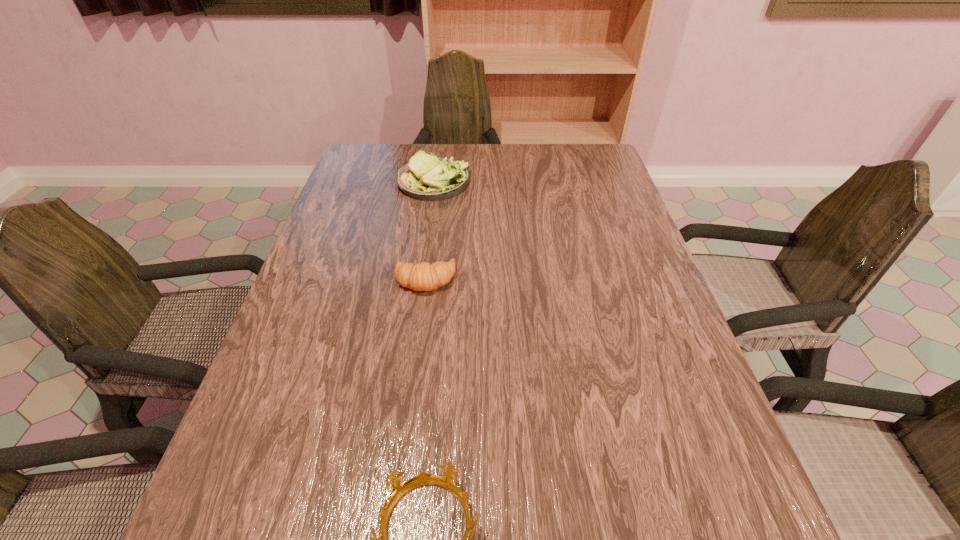
What are the coordinates of `vacant space at the far left corner` in the screenshot? It's located at (x=343, y=178).

In the image, there is a desktop. What are the coordinates of `free space at the far right corner` in the screenshot? It's located at (567, 156).

You are a GUI agent. You are given a task and a screenshot of the screen. Output one action in this format:
    pyautogui.click(x=<x>, y=<y>)
    Task: Click on the free space between the crescent roll and the tallest object
    This screenshot has width=960, height=540.
    Given the screenshot: What is the action you would take?
    pyautogui.click(x=429, y=231)

Where is `free area in between the farthest object and the crescent roll`? This screenshot has height=540, width=960. free area in between the farthest object and the crescent roll is located at coordinates (429, 231).

Point out which object is positioned as the nearest to the farthest object. Please provide its 2D coordinates. Your answer should be formatted as a tuple, i.e. [(x, y)], where the tuple contains the x and y coordinates of a point satisfying the conditions above.

[(422, 276)]

This screenshot has width=960, height=540. I want to click on object that stands as the second closest to the farthest object, so click(399, 488).